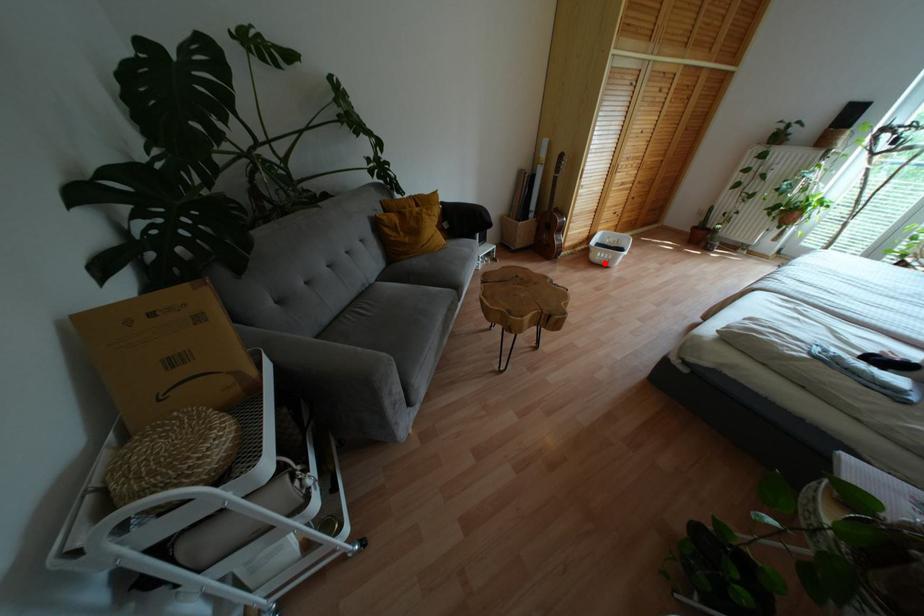
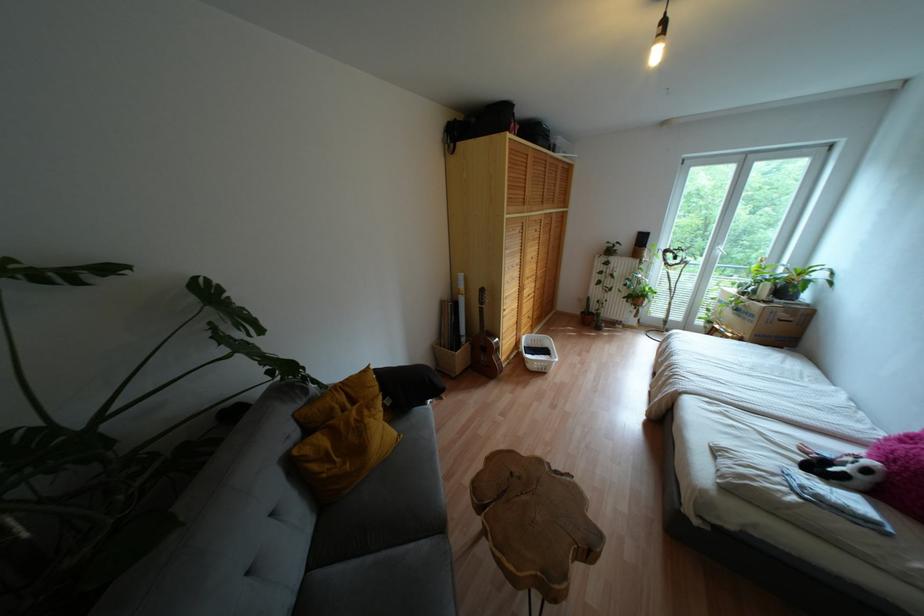
Where in the second image is the point corresponding to the highlighted location from the first image?

(542, 370)